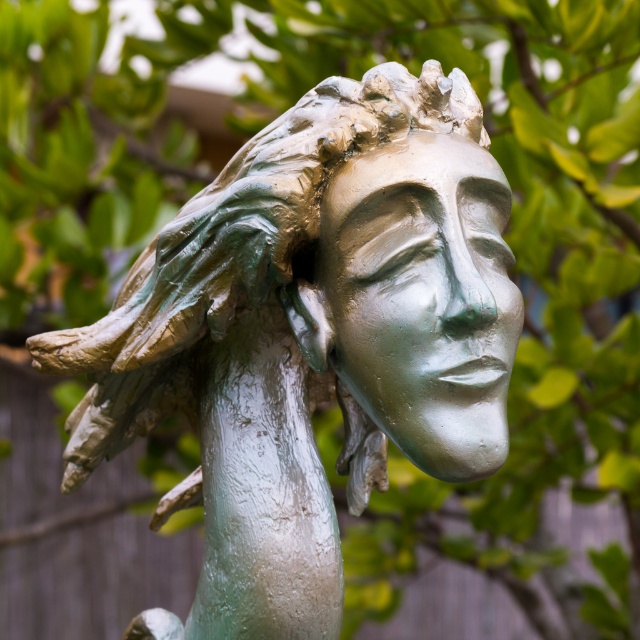
From the picture: You are an art conservator assessing the bronze sculpture. You need to determine if the statue can fit through a narrow doorway that is 1.2 meters wide. The statue and its face are both covered in green patina. Which part of the sculpture has a greater width, the green patina statue at center or the green patina face at center?

The green patina statue at center has a greater width than the green patina face at center, as stated in the description. Since the statue is wider than the face, you should measure the statue at center to ensure it can fit through the 1.2 meters wide doorway.

Looking at this image, you are an art conservator examining the bronze sculpture. You notice both the green patina statue at center and the green patina face at center. Which object is bigger in size?

The green patina statue at center is larger in size compared to the green patina face at center.

You are standing in front of the bronze sculpture and want to take a photo. The camera you are using has a focal length of 50mm and you want to focus on the point at point (192, 340). What is the minimum distance you should be from the sculpture to ensure the point is in focus?

The distance of point (192, 340) from the camera is 3.40 feet. Therefore, you should be at least 3.40 feet away from the sculpture to ensure the point is in focus.